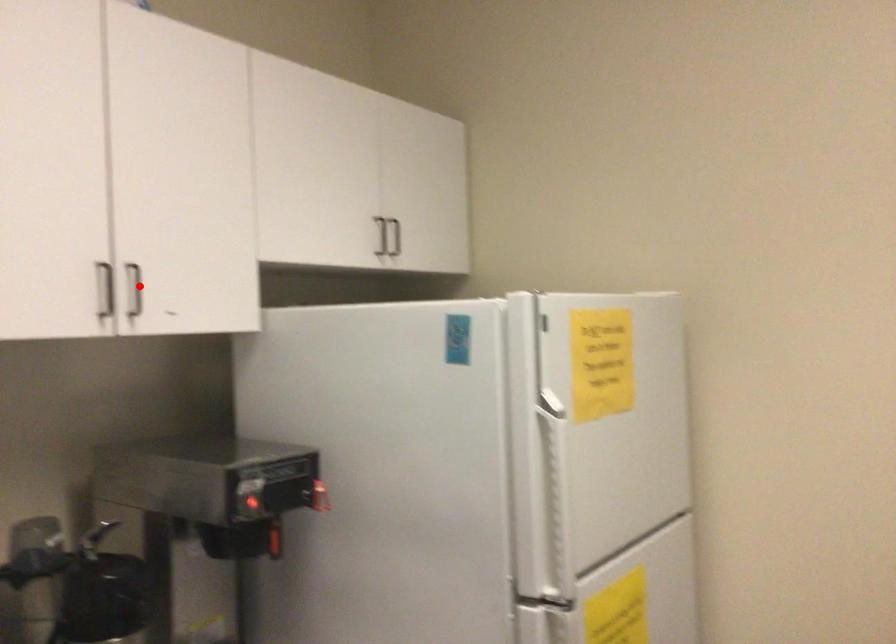
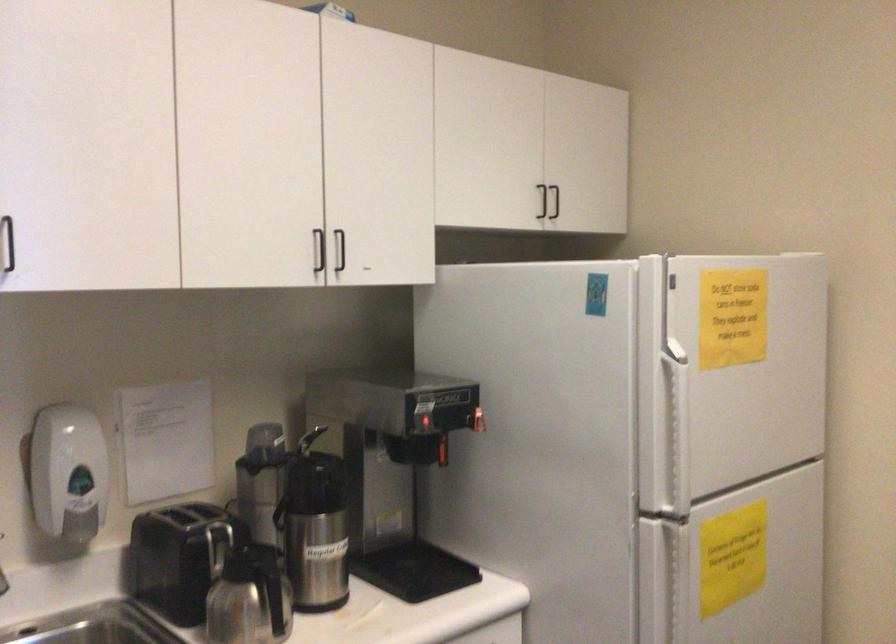
Find the pixel in the second image that matches the highlighted location in the first image.

(340, 249)